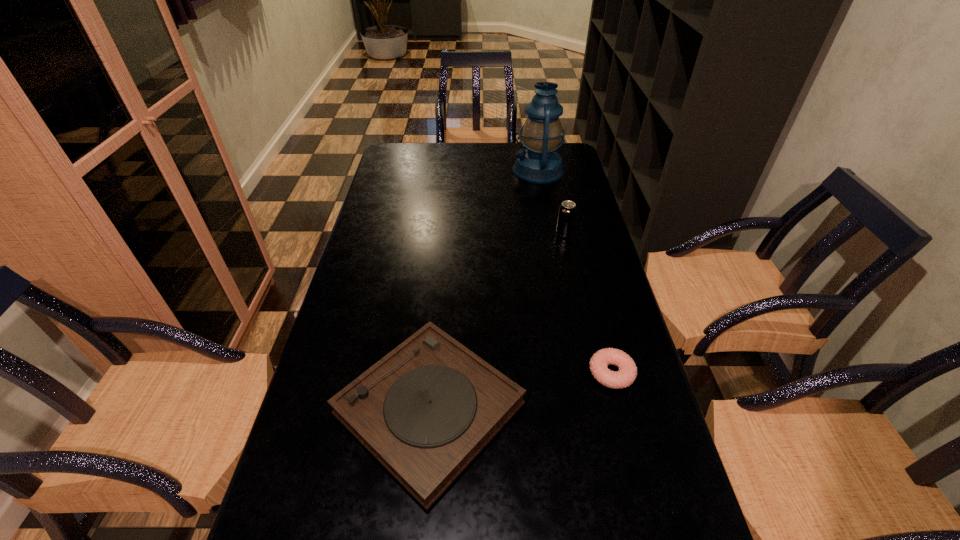
The width and height of the screenshot is (960, 540). What are the coordinates of `vacant space situated 0.260m on the front of the soda can` in the screenshot? It's located at (579, 298).

Locate an element on the screen. vacant space located 0.080m on the back of the third tallest object is located at coordinates (439, 310).

Identify the location of vacant area located 0.100m on the front of the doughnut. The height and width of the screenshot is (540, 960). (628, 436).

Find the location of a particular element. object present at the far edge is located at coordinates (541, 133).

At what (x,y) coordinates should I click in order to perform the action: click on object that is at the left edge. Please return your answer as a coordinate pair (x, y). This screenshot has width=960, height=540. Looking at the image, I should click on (425, 410).

Identify the location of lantern that is positioned at the right edge. click(x=541, y=133).

Image resolution: width=960 pixels, height=540 pixels. I want to click on soda can situated at the right edge, so click(567, 211).

Image resolution: width=960 pixels, height=540 pixels. Find the location of `doughnut that is at the right edge`. doughnut that is at the right edge is located at coordinates (627, 373).

I want to click on object positioned at the far right corner, so click(541, 133).

The image size is (960, 540). I want to click on free space at the left edge of the desktop, so click(x=300, y=419).